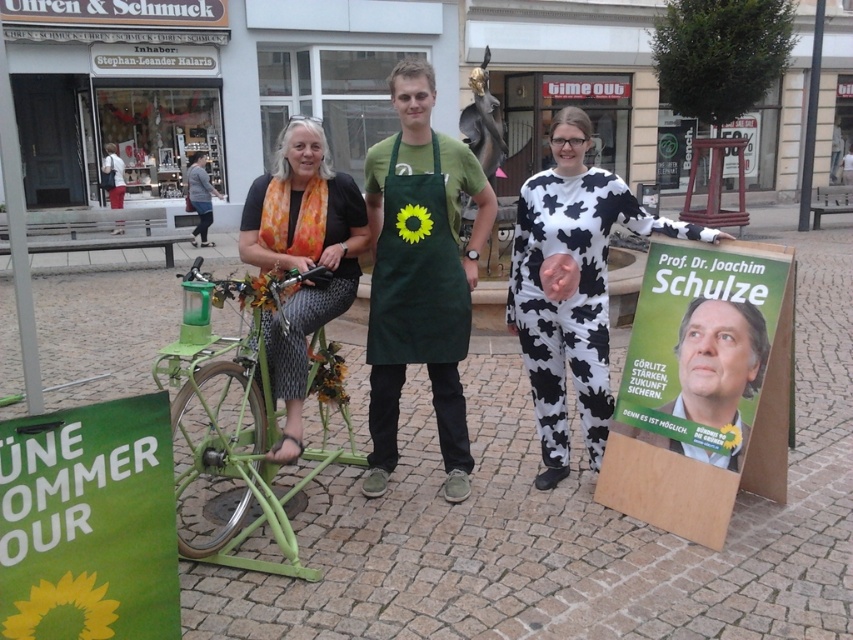
Question: Which of these objects is positioned closest to the cow print jumpsuit at center?

Choices:
 (A) green matte bicycle at center
 (B) green paper poster at lower left
 (C) matte green poster at center

Answer: (C)

Question: Which of these objects is positioned closest to the green paper poster at lower left?

Choices:
 (A) cow print jumpsuit at center
 (B) matte black shirt at center
 (C) green canvas apron at center
 (D) green matte bicycle at center

Answer: (D)

Question: Is matte black shirt at center closer to the viewer compared to green canvas apron at center?

Choices:
 (A) yes
 (B) no

Answer: (A)

Question: Among these points, which one is farthest from the camera?

Choices:
 (A) (737, 308)
 (B) (209, 204)

Answer: (B)

Question: Considering the relative positions of cow print jumpsuit at center and matte green poster at center in the image provided, where is cow print jumpsuit at center located with respect to matte green poster at center?

Choices:
 (A) left
 (B) right

Answer: (A)

Question: Can you confirm if matte black shirt at center is thinner than gray cotton shirt at upper left?

Choices:
 (A) no
 (B) yes

Answer: (B)